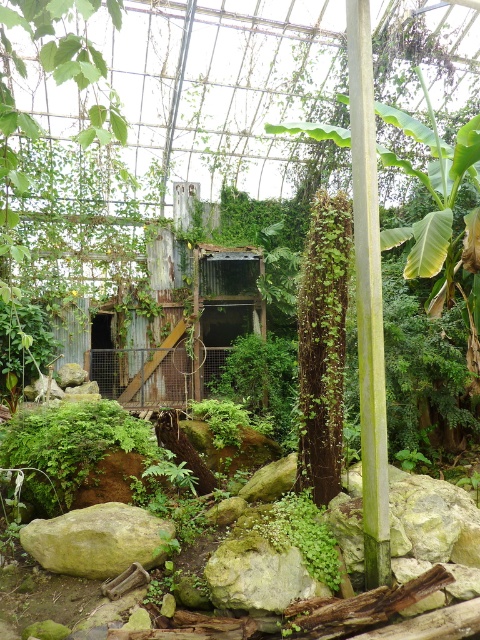
You are a gardener who needs to place a small potted plant between the green mossy rock at center and the green mossy rock at lower left. Which rock should the potted plant be closer to if you want it to be near the wider rock?

The green mossy rock at center is wider than the green mossy rock at lower left. Therefore, the potted plant should be placed closer to the green mossy rock at center to be near the wider rock.

You are standing at point (67, 552) and want to walk to the exit located at point (21, 435). Can you see the exit directly from your current position?

Point (21, 435) is behind point (67, 552), so you cannot see the exit at point (21, 435) directly from your current position at point (67, 552) because it is obstructed by the structure or vegetation between them.